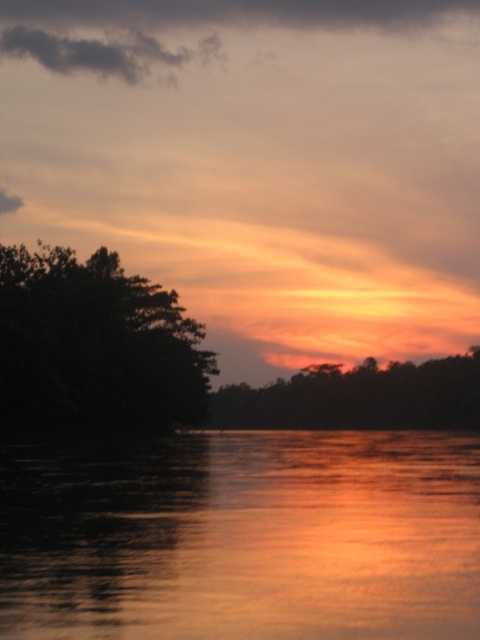
You are standing on the shore of the lake and see two points in the water. The first point is located at coordinates point [364,595] and the second point is at point [105,372]. Which point is closer to you?

Point [364,595] is in front of point [105,372], so the point closer to you is point [364,595].

You are standing at the edge of the water and see two points in the sunset scene. The first is point [479,572] and the second is point [350,385]. Which point is closer to you?

Point [479,572] is closer to the camera than point [350,385], so the first point is closer to you.

You are a photographer standing on the shore of the water. You want to capture a photo that includes both the glossy water at center and the silhouette tree at center. Given that your camera can focus on objects up to 100 meters away, will both objects be in focus in the same shot?

The distance between the glossy water at center and the silhouette tree at center is 73.43 meters. Since your camera can focus up to 100 meters, both objects will be within the focus range and can be captured in focus in the same shot.